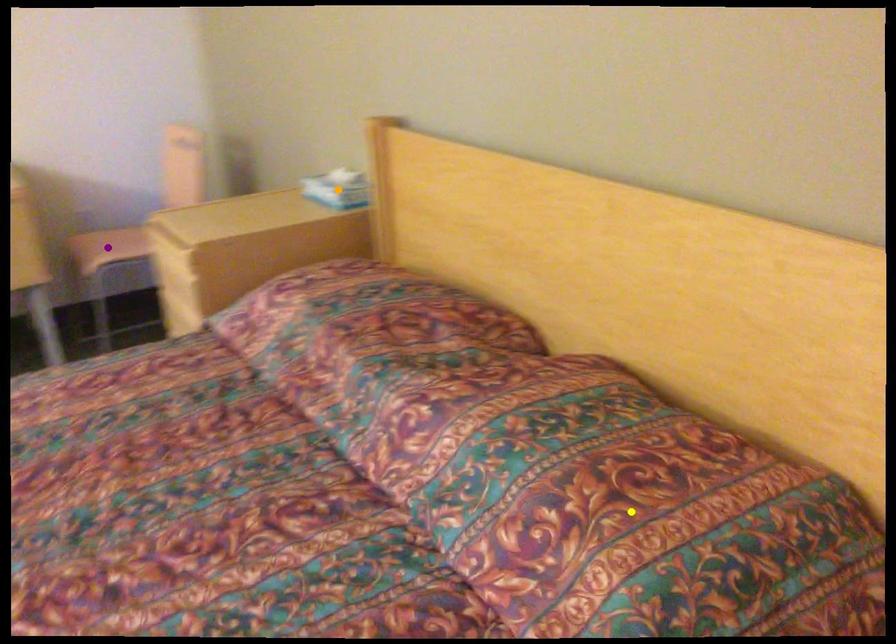
Order these from farthest to nearest:
yellow point | orange point | purple point

purple point
orange point
yellow point